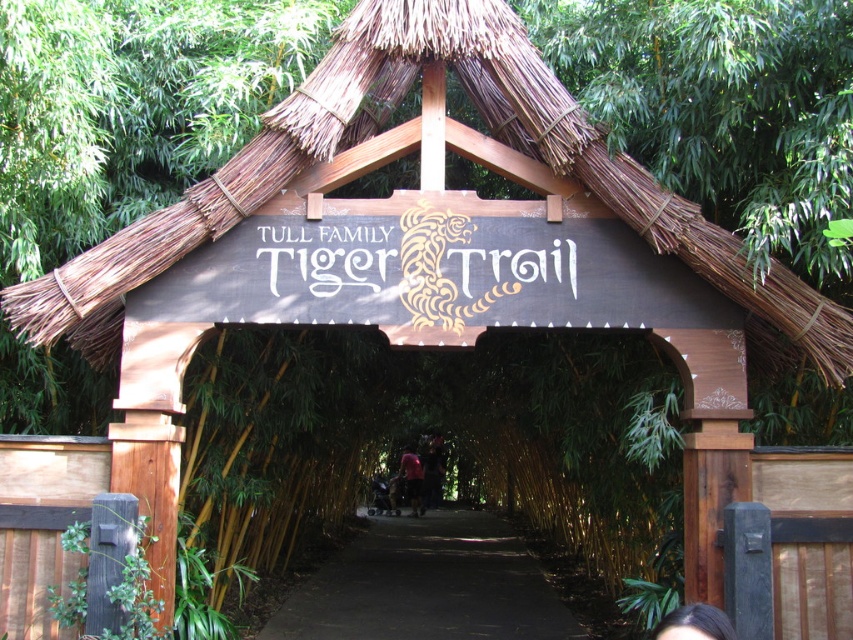
Question: Can you confirm if dark brown leather jacket at center is positioned to the left of dark red fabric shirt at center?

Choices:
 (A) no
 (B) yes

Answer: (A)

Question: In this image, where is dark brown hair at lower center located relative to dark red fabric shirt at center?

Choices:
 (A) below
 (B) above

Answer: (B)

Question: Among these objects, which one is farthest from the camera?

Choices:
 (A) dark brown hair at lower center
 (B) dark brown leather jacket at center
 (C) dirt path at center
 (D) dark red fabric shirt at center

Answer: (D)

Question: Is dark brown hair at lower center bigger than dark brown leather jacket at center?

Choices:
 (A) yes
 (B) no

Answer: (B)

Question: Which is farther from the dirt path at center?

Choices:
 (A) dark red fabric shirt at center
 (B) dark brown leather jacket at center

Answer: (B)

Question: Among these objects, which one is farthest from the camera?

Choices:
 (A) dark brown hair at lower center
 (B) dark brown leather jacket at center
 (C) dirt path at center

Answer: (B)